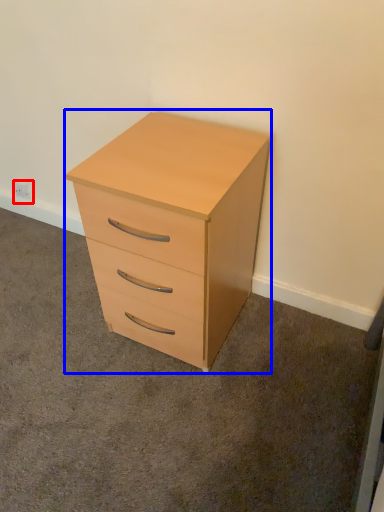
Question: Which point is further to the camera, electric outlet (highlighted by a red box) or chest of drawers (highlighted by a blue box)?

Choices:
 (A) electric outlet
 (B) chest of drawers

Answer: (A)